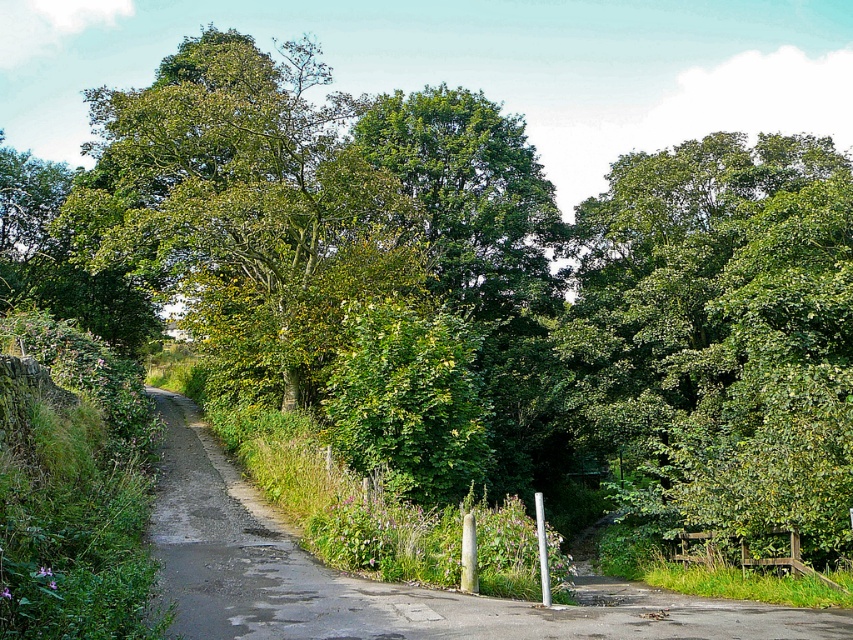
You are a hiker standing at point (694,620) and want to reach point (200,77). Given the winding road, which direction should you head to follow the road towards your destination?

Point (200,77) is behind point (694,620), so you should head in the direction opposite to where the road curves to the right to follow the road towards your destination.